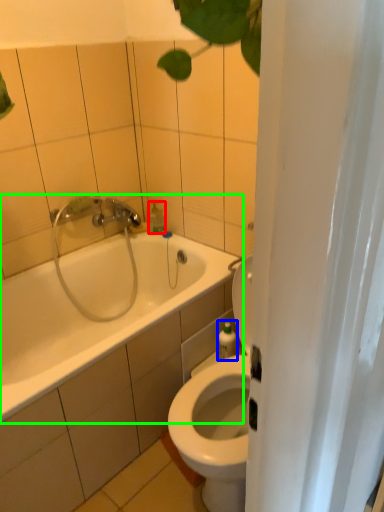
Question: Which object is the farthest from soap dispenser (highlighted by a red box)? Choose among these: toiletry (highlighted by a blue box) or bathtub (highlighted by a green box).

Choices:
 (A) toiletry
 (B) bathtub

Answer: (A)